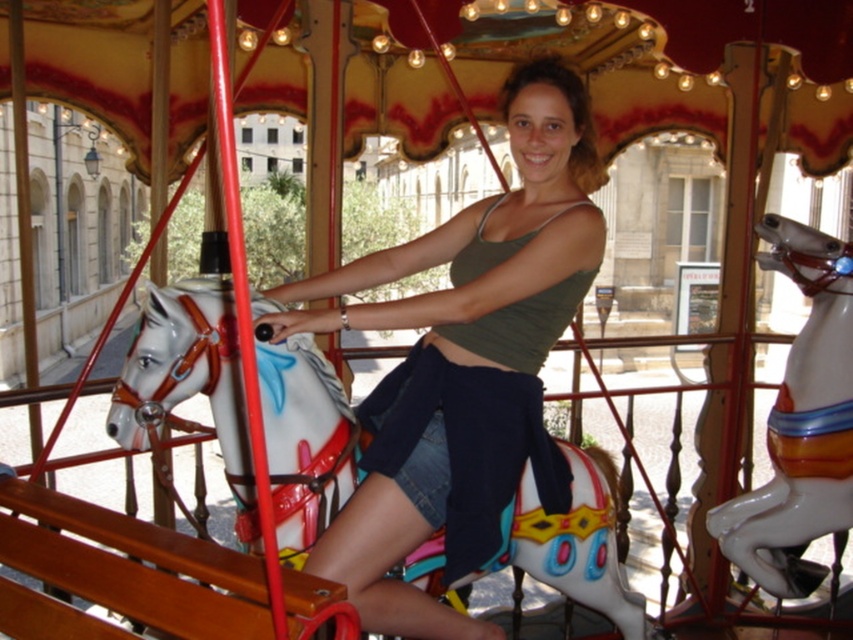
Question: Which point is farther from the camera taking this photo?

Choices:
 (A) (780, 596)
 (B) (612, 490)
 (C) (477, 349)

Answer: (A)

Question: Which point is farther to the camera?

Choices:
 (A) shiny white horse at center
 (B) green cotton tank top at center
 (C) white glossy horse at center

Answer: (A)

Question: Is green cotton tank top at center below white glossy horse at center?

Choices:
 (A) no
 (B) yes

Answer: (A)

Question: Can you confirm if green cotton tank top at center is wider than shiny white horse at center?

Choices:
 (A) no
 (B) yes

Answer: (A)

Question: Which of the following is the farthest from the observer?

Choices:
 (A) shiny white horse at center
 (B) green cotton tank top at center

Answer: (A)

Question: Does green cotton tank top at center have a greater width compared to white glossy horse at center?

Choices:
 (A) yes
 (B) no

Answer: (A)